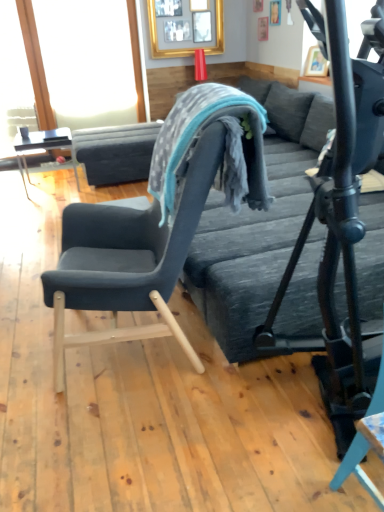
Question: Is textured gray bed frame at center in contact with textured gray bean bag chair at center?

Choices:
 (A) no
 (B) yes

Answer: (A)

Question: Considering the relative sizes of textured gray bed frame at center and textured gray bean bag chair at center in the image provided, is textured gray bed frame at center taller than textured gray bean bag chair at center?

Choices:
 (A) no
 (B) yes

Answer: (B)

Question: Is textured gray bed frame at center at the left side of textured gray bean bag chair at center?

Choices:
 (A) yes
 (B) no

Answer: (B)

Question: Is textured gray bed frame at center located outside textured gray bean bag chair at center?

Choices:
 (A) yes
 (B) no

Answer: (A)

Question: From a real-world perspective, is textured gray bed frame at center located beneath textured gray bean bag chair at center?

Choices:
 (A) yes
 (B) no

Answer: (A)

Question: Considering the relative sizes of textured gray bed frame at center and textured gray bean bag chair at center in the image provided, is textured gray bed frame at center wider than textured gray bean bag chair at center?

Choices:
 (A) no
 (B) yes

Answer: (B)

Question: From the image's perspective, is transparent glass window screen at upper left above matte black table at left?

Choices:
 (A) yes
 (B) no

Answer: (A)

Question: Does transparent glass window screen at upper left appear on the left side of matte black table at left?

Choices:
 (A) no
 (B) yes

Answer: (A)

Question: Is transparent glass window screen at upper left in front of matte black table at left?

Choices:
 (A) no
 (B) yes

Answer: (A)

Question: From a real-world perspective, is transparent glass window screen at upper left positioned over matte black table at left based on gravity?

Choices:
 (A) yes
 (B) no

Answer: (A)

Question: Is transparent glass window screen at upper left further to the viewer compared to matte black table at left?

Choices:
 (A) no
 (B) yes

Answer: (B)

Question: Can you confirm if transparent glass window screen at upper left is smaller than matte black table at left?

Choices:
 (A) no
 (B) yes

Answer: (B)

Question: Can transparent glass window screen at upper left be found inside gold-framed picture at upper center?

Choices:
 (A) no
 (B) yes

Answer: (A)